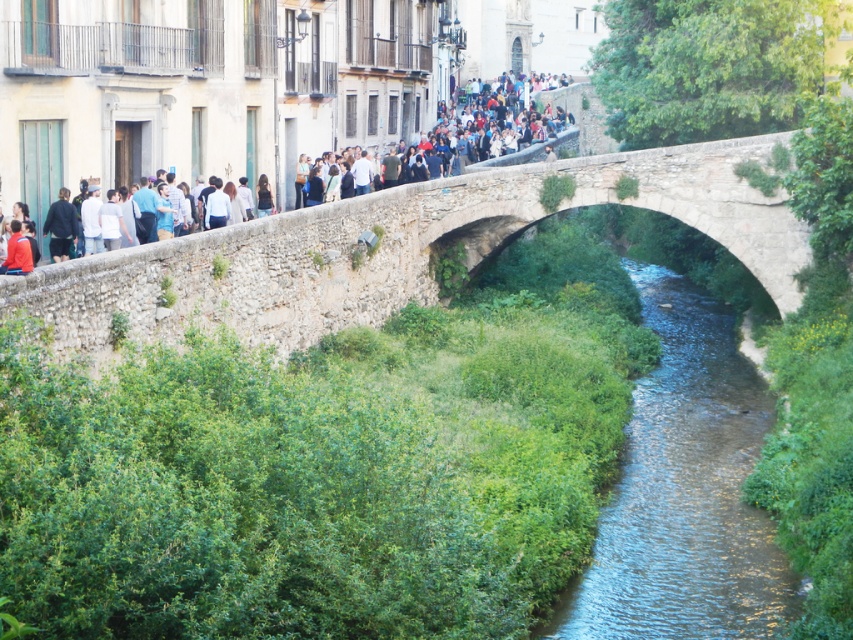
Can you confirm if clear water stream at center is positioned below matte stone bridge at upper center?

Indeed, clear water stream at center is positioned under matte stone bridge at upper center.

Describe the element at coordinates (685, 490) in the screenshot. Image resolution: width=853 pixels, height=640 pixels. I see `clear water stream at center` at that location.

Image resolution: width=853 pixels, height=640 pixels. Find the location of `clear water stream at center`. clear water stream at center is located at coordinates (685, 490).

Does stone arch bridge at upper center have a greater height compared to matte stone bridge at upper center?

Incorrect, stone arch bridge at upper center's height is not larger of matte stone bridge at upper center's.

Is point (465, 262) closer to viewer compared to point (42, 204)?

No.

The height and width of the screenshot is (640, 853). Identify the location of stone arch bridge at upper center. (631, 204).

From the picture: Can you confirm if clear water stream at center is wider than stone arch bridge at upper center?

No, clear water stream at center is not wider than stone arch bridge at upper center.

Who is higher up, clear water stream at center or stone arch bridge at upper center?

stone arch bridge at upper center

Image resolution: width=853 pixels, height=640 pixels. Describe the element at coordinates (685, 490) in the screenshot. I see `clear water stream at center` at that location.

At what (x,y) coordinates should I click in order to perform the action: click on clear water stream at center. Please return your answer as a coordinate pair (x, y). The height and width of the screenshot is (640, 853). Looking at the image, I should click on (685, 490).